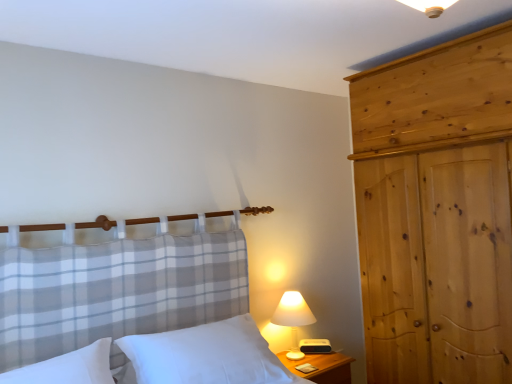
Question: Is white soft pillow at lower left taller or shorter than wooden at right?

Choices:
 (A) tall
 (B) short

Answer: (B)

Question: Which is correct: white soft pillow at lower left is inside wooden at right, or outside of it?

Choices:
 (A) outside
 (B) inside

Answer: (A)

Question: Based on their relative distances, which object is farther from the natural wood wardrobe at right?

Choices:
 (A) white soft pillow at lower left
 (B) white fabric lampshade at right
 (C) white soft pillow at center
 (D) wooden at right

Answer: (A)

Question: Which is farther from the white fabric lampshade at right?

Choices:
 (A) white soft pillow at center
 (B) wooden at right
 (C) white soft pillow at lower left
 (D) natural wood wardrobe at right

Answer: (C)